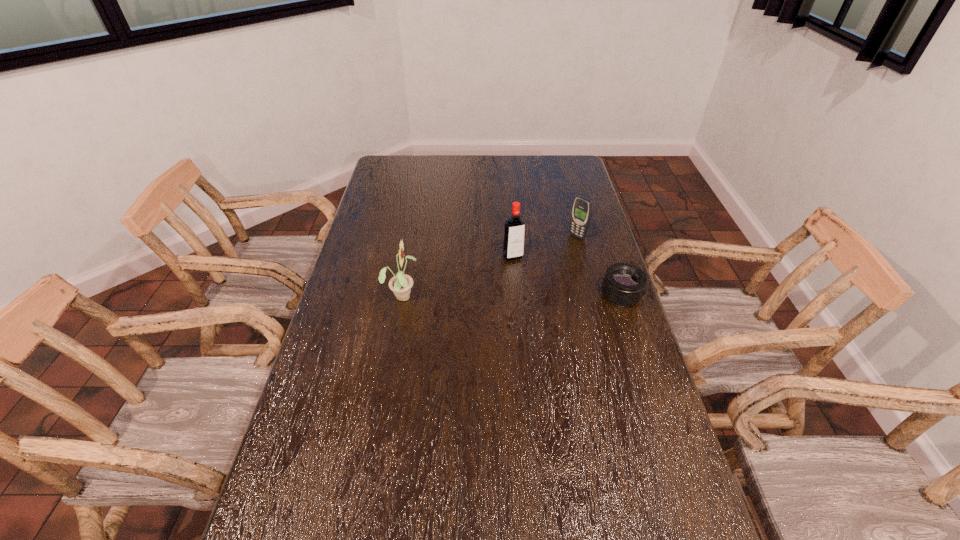
Identify the location of vacant space located 0.190m on the front and back of the third object from right to left. (536, 299).

Identify the location of free region located on the front and back of the third object from right to left. (536, 299).

Image resolution: width=960 pixels, height=540 pixels. Find the location of `vacant region located 0.400m on the front and back of the third object from right to left`. vacant region located 0.400m on the front and back of the third object from right to left is located at coordinates (561, 348).

You are a GUI agent. You are given a task and a screenshot of the screen. Output one action in this format:
    pyautogui.click(x=<x>, y=<y>)
    Task: Click on the object present at the left edge
    This screenshot has height=540, width=960.
    Given the screenshot: What is the action you would take?
    pyautogui.click(x=401, y=284)

The height and width of the screenshot is (540, 960). I want to click on telephoto lens at the right edge, so click(624, 284).

Identify the location of cellular telephone at the right edge. The width and height of the screenshot is (960, 540). (582, 208).

Image resolution: width=960 pixels, height=540 pixels. In order to click on vacant space at the far edge of the desktop in this screenshot , I will do `click(443, 173)`.

Where is `free spot at the near edge of the desktop`? free spot at the near edge of the desktop is located at coordinates (417, 532).

This screenshot has height=540, width=960. In the image, there is a desktop. What are the coordinates of `vacant area at the left edge` in the screenshot? It's located at (338, 334).

Where is `free space at the right edge of the desktop`? The image size is (960, 540). free space at the right edge of the desktop is located at coordinates (552, 191).